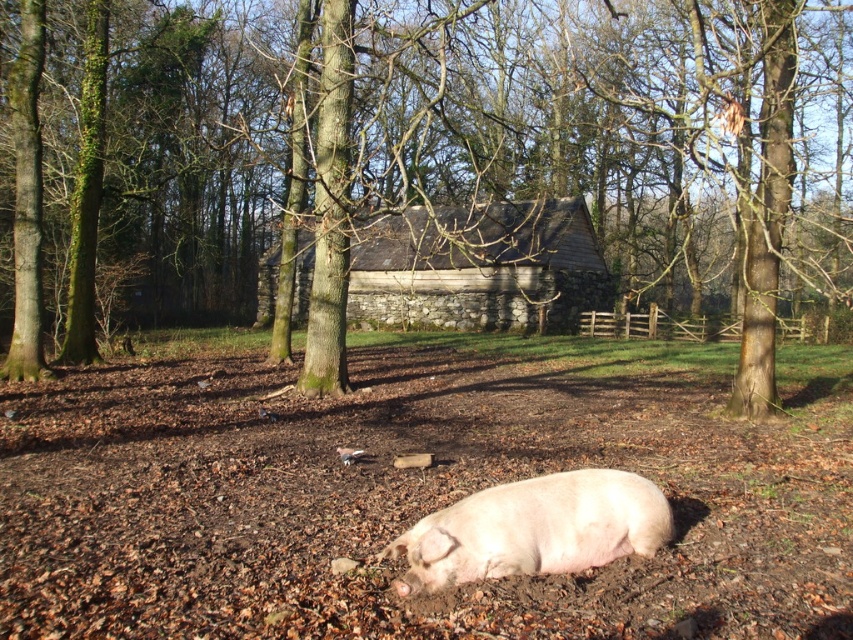
Which is in front, point (85, 400) or point (566, 500)?

Point (566, 500)

Looking at this image, who is higher up, brown soil at center or pink smooth pig at lower center?

brown soil at center is above.

This screenshot has width=853, height=640. What do you see at coordinates (418, 492) in the screenshot? I see `brown soil at center` at bounding box center [418, 492].

Locate an element on the screen. This screenshot has width=853, height=640. brown soil at center is located at coordinates (418, 492).

Is the position of brown textured tree at center more distant than that of pink smooth pig at lower center?

Yes.

Between brown textured tree at center and pink smooth pig at lower center, which one has more height?

brown textured tree at center

Is point (498, 182) closer to camera compared to point (451, 524)?

No, it is behind (451, 524).

Find the location of a particular element. brown textured tree at center is located at coordinates (434, 164).

The height and width of the screenshot is (640, 853). What do you see at coordinates (434, 164) in the screenshot?
I see `brown textured tree at center` at bounding box center [434, 164].

Is point (96, 188) farther from camera compared to point (65, 420)?

Yes.

What do you see at coordinates (434, 164) in the screenshot? This screenshot has width=853, height=640. I see `brown textured tree at center` at bounding box center [434, 164].

The height and width of the screenshot is (640, 853). I want to click on brown textured tree at center, so click(434, 164).